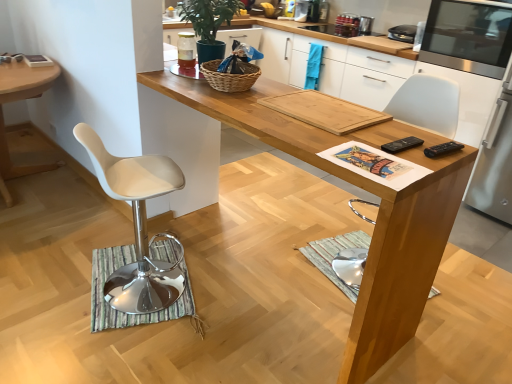
The height and width of the screenshot is (384, 512). In order to click on free location to the left of light brown wood desk at center, which is counted as the first desk, starting from the right in this screenshot , I will do `click(83, 275)`.